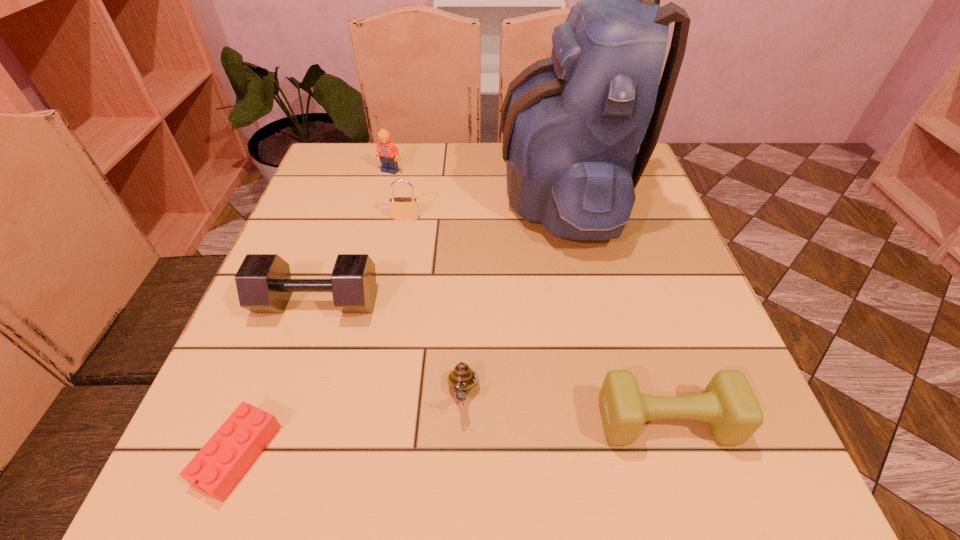
The image size is (960, 540). In order to click on backpack positioned at the far edge in this screenshot , I will do `click(572, 124)`.

Where is `Lego positioned at the far edge`? This screenshot has height=540, width=960. Lego positioned at the far edge is located at coordinates (388, 153).

At what (x,y) coordinates should I click in order to perform the action: click on dumbbell situated at the near edge. Please return your answer as a coordinate pair (x, y). Looking at the image, I should click on (728, 404).

This screenshot has width=960, height=540. Identify the location of Lego that is at the near edge. (217, 468).

Where is `dumbbell that is at the left edge`? This screenshot has height=540, width=960. dumbbell that is at the left edge is located at coordinates (264, 285).

The image size is (960, 540). In order to click on backpack present at the right edge in this screenshot , I will do `click(572, 124)`.

Identify the location of dumbbell that is at the right edge. Image resolution: width=960 pixels, height=540 pixels. (728, 404).

The image size is (960, 540). I want to click on object located in the far left corner section of the desktop, so click(388, 153).

You are a GUI agent. You are given a task and a screenshot of the screen. Output one action in this format:
    pyautogui.click(x=<x>, y=<y>)
    Task: Click on the object present at the near left corner
    This screenshot has width=960, height=540.
    Given the screenshot: What is the action you would take?
    pyautogui.click(x=217, y=468)

Where is `object that is at the far right corner`? object that is at the far right corner is located at coordinates (572, 124).